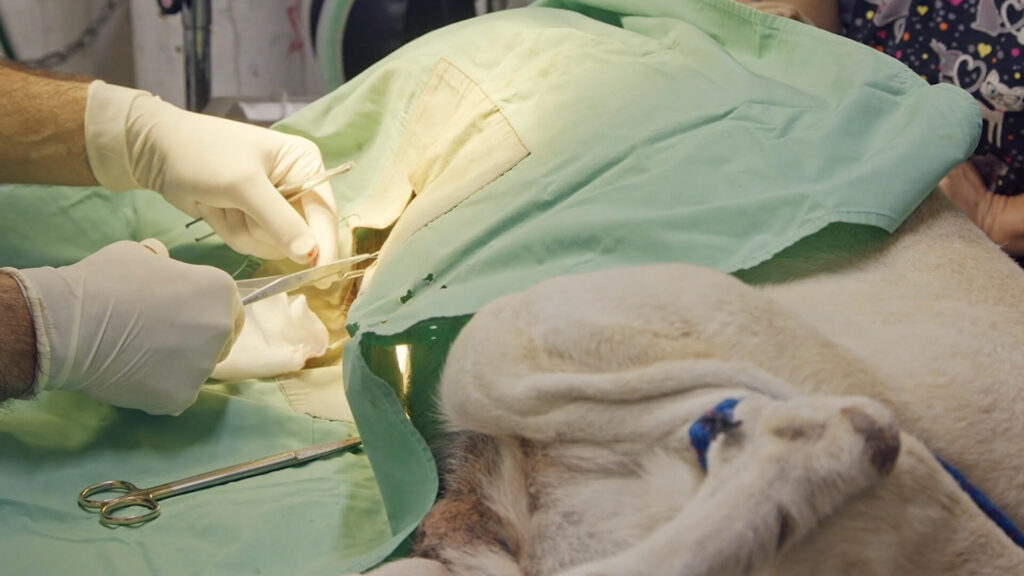
The image size is (1024, 576). What are the coordinates of `cover` in the screenshot? It's located at (596, 151).